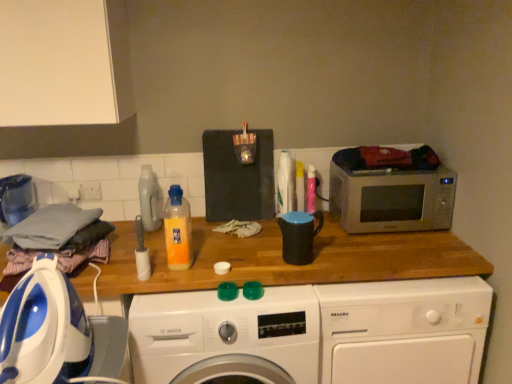
What do you see at coordinates (224, 331) in the screenshot? The height and width of the screenshot is (384, 512). I see `white plastic washing machine at center, acting as the 2th washing machine starting from the right` at bounding box center [224, 331].

Where is `matte plastic detergent at center, the 2th bottle viewed from the front`? matte plastic detergent at center, the 2th bottle viewed from the front is located at coordinates (150, 199).

I want to click on white plastic roll at center, the 1th appliance when ordered from left to right, so click(141, 252).

Measure the distance between silver metallic microwave at right and camera.

silver metallic microwave at right and camera are 5.45 feet apart from each other.

Where is `white plastic washing machine at center, the third washing machine in the left-to-right sequence`? white plastic washing machine at center, the third washing machine in the left-to-right sequence is located at coordinates (404, 330).

Find the location of `translucent orange liquid at center, which is counted as the second bottle, starting from the back`. translucent orange liquid at center, which is counted as the second bottle, starting from the back is located at coordinates (178, 230).

How far apart are white plastic washing machine at center, the third washing machine in the left-to-right sequence, and translucent orange liquid at center, which is counted as the second bottle, starting from the back?

white plastic washing machine at center, the third washing machine in the left-to-right sequence, and translucent orange liquid at center, which is counted as the second bottle, starting from the back, are 28.81 inches apart from each other.

Who is smaller, white plastic washing machine at center, which is counted as the first washing machine, starting from the right, or translucent orange liquid at center, marked as the 1th bottle in a right-to-left arrangement?

translucent orange liquid at center, marked as the 1th bottle in a right-to-left arrangement, is smaller.

Is white plastic washing machine at center, which is counted as the first washing machine, starting from the right, in contact with translucent orange liquid at center, the 1th bottle from the front?

No.

Is white plastic washing machine at center, the third washing machine in the left-to-right sequence, thinner than translucent orange liquid at center, marked as the 1th bottle in a right-to-left arrangement?

No, white plastic washing machine at center, the third washing machine in the left-to-right sequence, is not thinner than translucent orange liquid at center, marked as the 1th bottle in a right-to-left arrangement.

Considering the relative sizes of blue/white plastic iron at left, which is the first washing machine from left to right, and translucent orange liquid at center, the 1th bottle from the front, in the image provided, is blue/white plastic iron at left, which is the first washing machine from left to right, smaller than translucent orange liquid at center, the 1th bottle from the front,?

No.

Is blue/white plastic iron at left, the 3th washing machine viewed from the right, surrounding translucent orange liquid at center, which is counted as the second bottle, starting from the back?

No, translucent orange liquid at center, which is counted as the second bottle, starting from the back, is not a part of blue/white plastic iron at left, the 3th washing machine viewed from the right.

From a real-world perspective, is blue/white plastic iron at left, the 3th washing machine viewed from the right, positioned over translucent orange liquid at center, the 1th bottle from the front, based on gravity?

No, from a real-world perspective, blue/white plastic iron at left, the 3th washing machine viewed from the right, is not above translucent orange liquid at center, the 1th bottle from the front.

Between blue/white plastic iron at left, the 3th washing machine viewed from the right, and translucent orange liquid at center, which is the second bottle from left to right, which one has smaller width?

translucent orange liquid at center, which is the second bottle from left to right.

Looking at this image, is blue/white plastic iron at left, which is the first washing machine from left to right, closer to camera compared to white plastic washing machine at center, acting as the 2th washing machine starting from the right?

Yes, blue/white plastic iron at left, which is the first washing machine from left to right, is in front of white plastic washing machine at center, acting as the 2th washing machine starting from the right.

Which object is positioned more to the left, blue/white plastic iron at left, which is the first washing machine from left to right, or white plastic washing machine at center, the second washing machine from the left?

From the viewer's perspective, blue/white plastic iron at left, which is the first washing machine from left to right, appears more on the left side.

Is blue/white plastic iron at left, the 3th washing machine viewed from the right, with white plastic washing machine at center, the second washing machine from the left?

No, blue/white plastic iron at left, the 3th washing machine viewed from the right, is not next to white plastic washing machine at center, the second washing machine from the left.

Can we say white plastic roll at center, the 1th appliance when ordered from left to right, lies outside black matte mug at center, which is counted as the 2th appliance, starting from the left?

white plastic roll at center, the 1th appliance when ordered from left to right, lies outside black matte mug at center, which is counted as the 2th appliance, starting from the left,'s area.

From the image's perspective, is white plastic roll at center, the 1th appliance when ordered from left to right, located above or below black matte mug at center, which ranks as the first appliance in back-to-front order?

From the image's perspective, white plastic roll at center, the 1th appliance when ordered from left to right, appears below black matte mug at center, which ranks as the first appliance in back-to-front order.

Considering the sizes of objects white plastic roll at center, positioned as the second appliance in back-to-front order, and black matte mug at center, which ranks as the first appliance in back-to-front order, in the image provided, who is bigger, white plastic roll at center, positioned as the second appliance in back-to-front order, or black matte mug at center, which ranks as the first appliance in back-to-front order,?

black matte mug at center, which ranks as the first appliance in back-to-front order.

From a real-world perspective, relative to silver metallic microwave at right, is blue/white plastic iron at left, the 3th washing machine viewed from the right, vertically above or below?

Clearly, from a real-world perspective, blue/white plastic iron at left, the 3th washing machine viewed from the right, is below silver metallic microwave at right.

Is blue/white plastic iron at left, which is the first washing machine from left to right, aimed at silver metallic microwave at right?

No, blue/white plastic iron at left, which is the first washing machine from left to right, is not aimed at silver metallic microwave at right.

Looking at this image, considering the relative positions of blue/white plastic iron at left, the 3th washing machine viewed from the right, and silver metallic microwave at right in the image provided, is blue/white plastic iron at left, the 3th washing machine viewed from the right, to the right of silver metallic microwave at right from the viewer's perspective?

In fact, blue/white plastic iron at left, the 3th washing machine viewed from the right, is to the left of silver metallic microwave at right.

Does blue/white plastic iron at left, the 3th washing machine viewed from the right, have a lesser width compared to silver metallic microwave at right?

In fact, blue/white plastic iron at left, the 3th washing machine viewed from the right, might be wider than silver metallic microwave at right.

Which of these two, white plastic washing machine at center, acting as the 2th washing machine starting from the right, or white plastic washing machine at center, the third washing machine in the left-to-right sequence, stands shorter?

With less height is white plastic washing machine at center, acting as the 2th washing machine starting from the right.

Which point is more forward, (x=158, y=381) or (x=391, y=380)?

The point (x=158, y=381) is in front.

Is white plastic washing machine at center, the second washing machine from the left, next to white plastic washing machine at center, which is counted as the first washing machine, starting from the right, and touching it?

white plastic washing machine at center, the second washing machine from the left, is not next to white plastic washing machine at center, which is counted as the first washing machine, starting from the right, and they're not touching.

Looking at this image, is matte plastic detergent at center, placed as the second bottle when sorted from right to left, next to black matte mug at center, which appears as the 1th appliance when viewed from the right?

No, matte plastic detergent at center, placed as the second bottle when sorted from right to left, is not touching black matte mug at center, which appears as the 1th appliance when viewed from the right.

What's the angular difference between matte plastic detergent at center, the 2th bottle viewed from the front, and black matte mug at center, which is counted as the 2th appliance, starting from the left,'s facing directions?

4.46 degrees.

From the image's perspective, is matte plastic detergent at center, which ranks as the 1th bottle in left-to-right order, located above or below black matte mug at center, which appears as the 1th appliance when viewed from the right?

Clearly, from the image's perspective, matte plastic detergent at center, which ranks as the 1th bottle in left-to-right order, is above black matte mug at center, which appears as the 1th appliance when viewed from the right.

Is the position of matte plastic detergent at center, the 2th bottle viewed from the front, less distant than that of black matte mug at center, which appears as the 1th appliance when viewed from the right?

That is False.

Where is `the 2nd washing machine positioned below the translucent orange liquid at center, which is the second bottle from left to right (from the image's perspective)`? The image size is (512, 384). the 2nd washing machine positioned below the translucent orange liquid at center, which is the second bottle from left to right (from the image's perspective) is located at coordinates 404,330.

The width and height of the screenshot is (512, 384). What are the coordinates of `the 2nd bottle counting from the right of the blue/white plastic iron at left, which is the first washing machine from left to right` in the screenshot? It's located at (178, 230).

Which object lies nearer to the anchor point silver metallic microwave at right, white plastic washing machine at center, the third washing machine in the left-to-right sequence, or blue/white plastic iron at left, the 3th washing machine viewed from the right?

white plastic washing machine at center, the third washing machine in the left-to-right sequence.

Which object lies further to the anchor point white plastic washing machine at center, acting as the 2th washing machine starting from the right, silver metallic microwave at right or white plastic roll at center, which is the second appliance in right-to-left order?

Among the two, silver metallic microwave at right is located further to white plastic washing machine at center, acting as the 2th washing machine starting from the right.

Which object lies nearer to the anchor point black matte mug at center, which is counted as the 2th appliance, starting from the left, translucent orange liquid at center, marked as the 1th bottle in a right-to-left arrangement, or silver metallic microwave at right?

silver metallic microwave at right is positioned closer to the anchor black matte mug at center, which is counted as the 2th appliance, starting from the left.

Considering their positions, is blue/white plastic iron at left, the 3th washing machine viewed from the right, positioned further to matte plastic detergent at center, which ranks as the 1th bottle in left-to-right order, than white plastic washing machine at center, which is counted as the first washing machine, starting from the right?

Among the two, white plastic washing machine at center, which is counted as the first washing machine, starting from the right, is located further to matte plastic detergent at center, which ranks as the 1th bottle in left-to-right order.

Considering their positions, is translucent orange liquid at center, marked as the 1th bottle in a right-to-left arrangement, positioned closer to white plastic roll at center, which is the 1th appliance in front-to-back order, than white plastic washing machine at center, acting as the 2th washing machine starting from the right?

Based on the image, translucent orange liquid at center, marked as the 1th bottle in a right-to-left arrangement, appears to be nearer to white plastic roll at center, which is the 1th appliance in front-to-back order.

When comparing their distances from silver metallic microwave at right, does black matte mug at center, which appears as the 1th appliance when viewed from the right, or white plastic roll at center, positioned as the second appliance in back-to-front order, seem closer?

Based on the image, black matte mug at center, which appears as the 1th appliance when viewed from the right, appears to be nearer to silver metallic microwave at right.

Based on their spatial positions, is black matte mug at center, which is counted as the 2th appliance, starting from the left, or matte plastic detergent at center, the 2th bottle viewed from the front, closer to blue/white plastic iron at left, the 3th washing machine viewed from the right?

black matte mug at center, which is counted as the 2th appliance, starting from the left.

Considering their positions, is blue/white plastic iron at left, the 3th washing machine viewed from the right, positioned closer to matte plastic detergent at center, placed as the second bottle when sorted from right to left, than translucent orange liquid at center, which is counted as the second bottle, starting from the back?

translucent orange liquid at center, which is counted as the second bottle, starting from the back, is closer to matte plastic detergent at center, placed as the second bottle when sorted from right to left.

What are the coordinates of `washing machine located between white plastic roll at center, which is the 1th appliance in front-to-back order, and white plastic washing machine at center, which is counted as the first washing machine, starting from the right, in the left-right direction` in the screenshot? It's located at (224, 331).

Identify the location of appliance located between blue/white plastic iron at left, the 3th washing machine viewed from the right, and translucent orange liquid at center, the 1th bottle from the front, in the depth direction. Image resolution: width=512 pixels, height=384 pixels. (141, 252).

This screenshot has height=384, width=512. I want to click on bottle located between white plastic roll at center, positioned as the second appliance in back-to-front order, and white plastic washing machine at center, the third washing machine in the left-to-right sequence, in the left-right direction, so click(x=178, y=230).

Locate an element on the screen. Image resolution: width=512 pixels, height=384 pixels. bottle between blue/white plastic iron at left, the 3th washing machine viewed from the right, and black matte mug at center, which appears as the 1th appliance when viewed from the right, in the front-back direction is located at coordinates (178, 230).